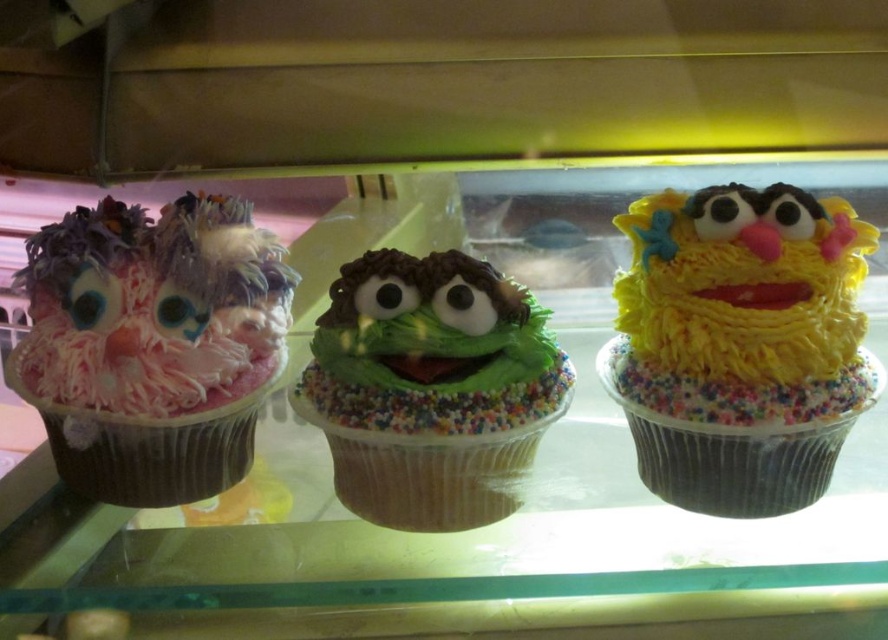
Which is in front, point (641, 228) or point (226, 208)?

Positioned in front is point (641, 228).

Does yellow frosting cupcake at center have a greater width compared to pink fluffy cupcake at left?

No, yellow frosting cupcake at center is not wider than pink fluffy cupcake at left.

Describe the element at coordinates (740, 344) in the screenshot. I see `yellow frosting cupcake at center` at that location.

The width and height of the screenshot is (888, 640). Find the location of `yellow frosting cupcake at center`. yellow frosting cupcake at center is located at coordinates (740, 344).

From the picture: Who is more forward, [839,212] or [430,512]?

Point [430,512] is in front.

Does yellow frosting cupcake at center appear under green frosted cupcake at center?

No.

Which is behind, point (839, 378) or point (419, 266)?

The point (419, 266) is behind.

Where is `yellow frosting cupcake at center`? yellow frosting cupcake at center is located at coordinates (740, 344).

Is pink fluffy cupcake at left in front of green frosted cupcake at center?

Yes, pink fluffy cupcake at left is in front of green frosted cupcake at center.

Which is below, pink fluffy cupcake at left or green frosted cupcake at center?

Positioned lower is green frosted cupcake at center.

Which is in front, point (125, 273) or point (525, 449)?

Point (125, 273)

This screenshot has width=888, height=640. Find the location of `pink fluffy cupcake at left`. pink fluffy cupcake at left is located at coordinates (152, 346).